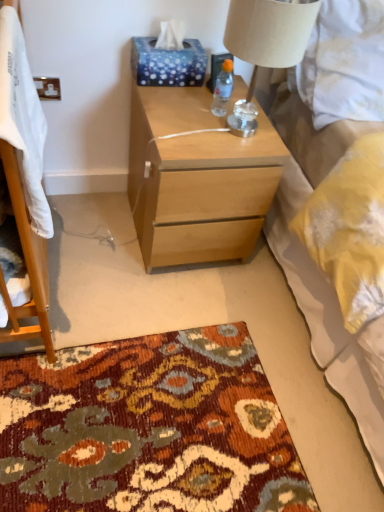
Locate an element on the screen. Image resolution: width=384 pixels, height=512 pixels. vacant space underneath beige fabric lampshade at upper right (from a real-world perspective) is located at coordinates (237, 127).